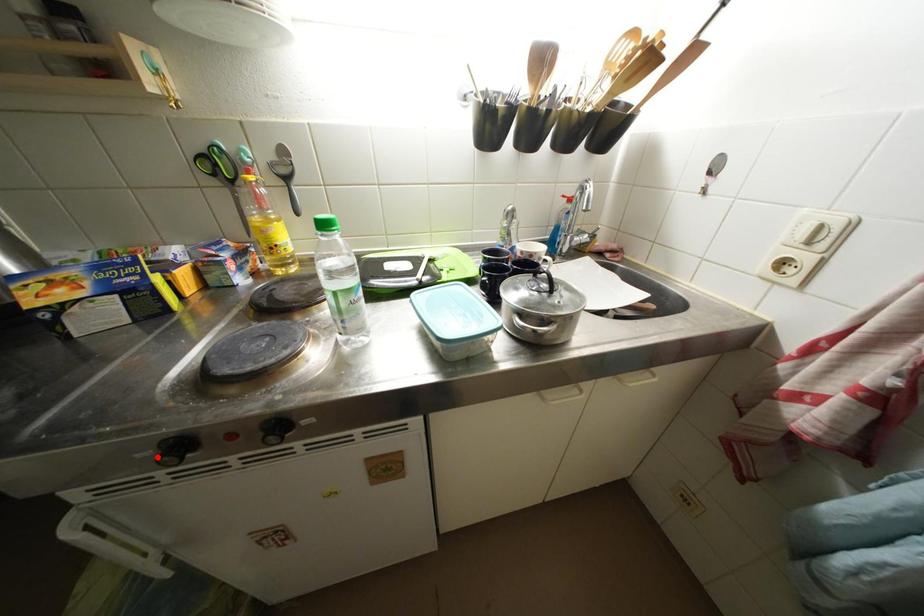
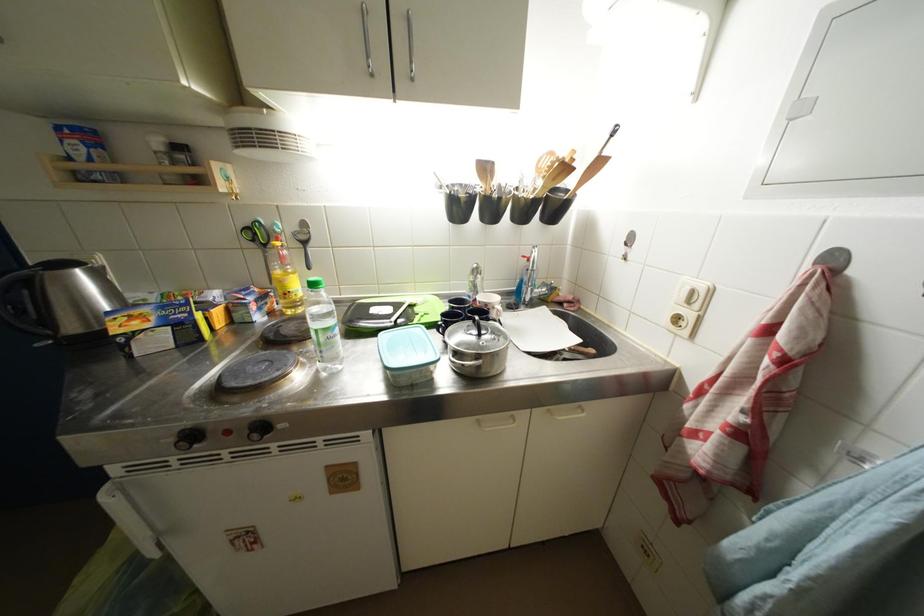
The point at the highlighted location is marked in the first image. Where is the corresponding point in the second image?

(178, 444)